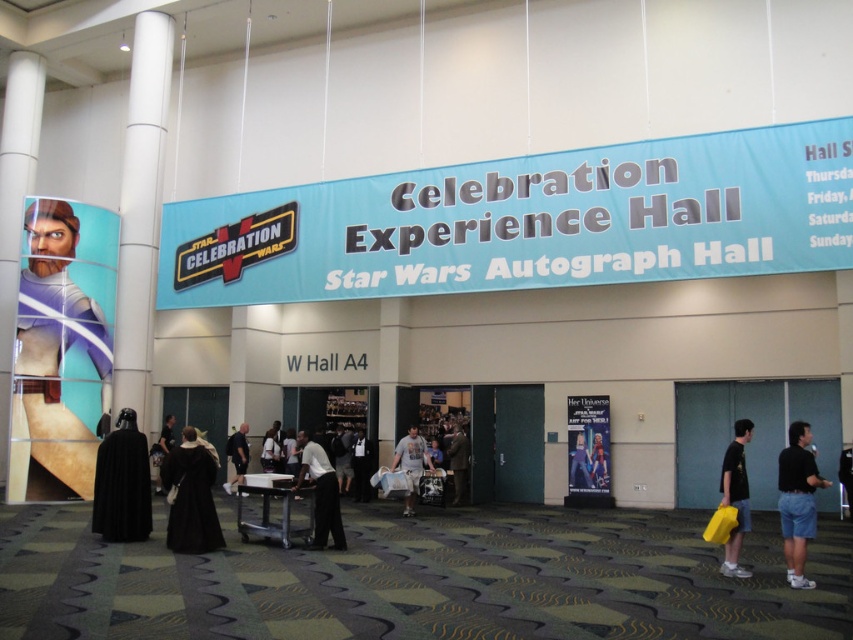
Looking at this image, can you confirm if white matte shirt at center is positioned to the left of smooth black suit at center?

Yes, white matte shirt at center is to the left of smooth black suit at center.

This screenshot has width=853, height=640. What do you see at coordinates (321, 492) in the screenshot?
I see `white matte shirt at center` at bounding box center [321, 492].

Identify the location of white matte shirt at center. (321, 492).

Between black velvet robe at center and dark gray suit at center, which one has less height?

Standing shorter between the two is black velvet robe at center.

Measure the distance between point (192,451) and camera.

A distance of 43.63 feet exists between point (192,451) and camera.

Where is `black velvet robe at center`? Image resolution: width=853 pixels, height=640 pixels. black velvet robe at center is located at coordinates (190, 496).

Between black velvet robe at center and black fabric person at lower right, which one has more height?

Standing taller between the two is black fabric person at lower right.

Is black velvet robe at center positioned in front of black fabric person at lower right?

Yes, black velvet robe at center is in front of black fabric person at lower right.

Is point (212, 541) behind point (846, 472)?

No, it is not.

Where is `black velvet robe at center`? black velvet robe at center is located at coordinates 190,496.